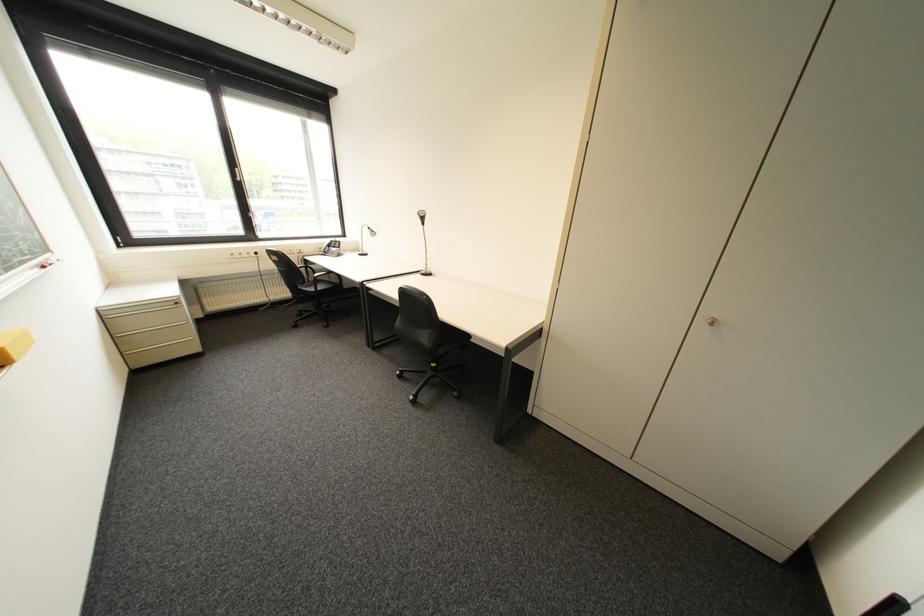
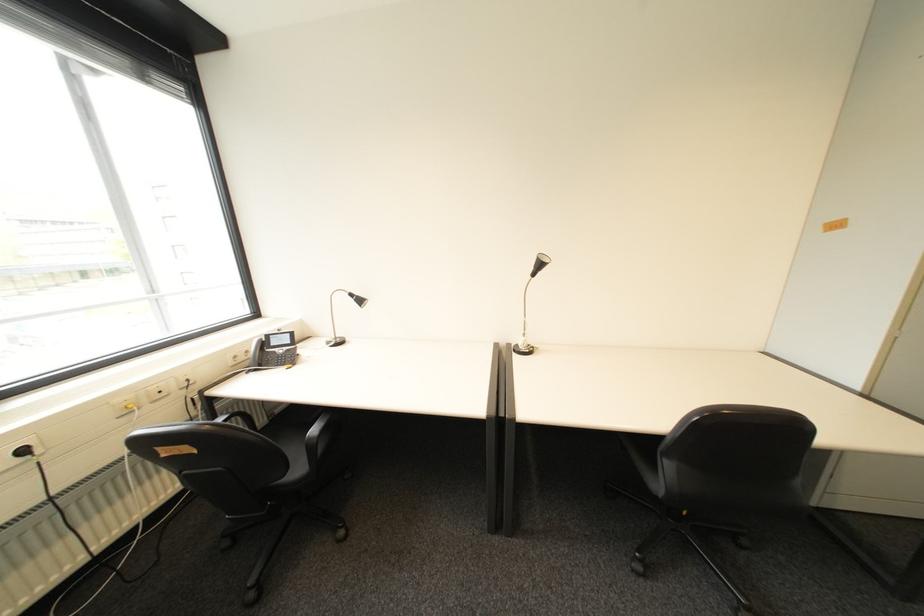
The point at (x=266, y=254) is marked in the first image. Where is the corresponding point in the second image?

(34, 452)